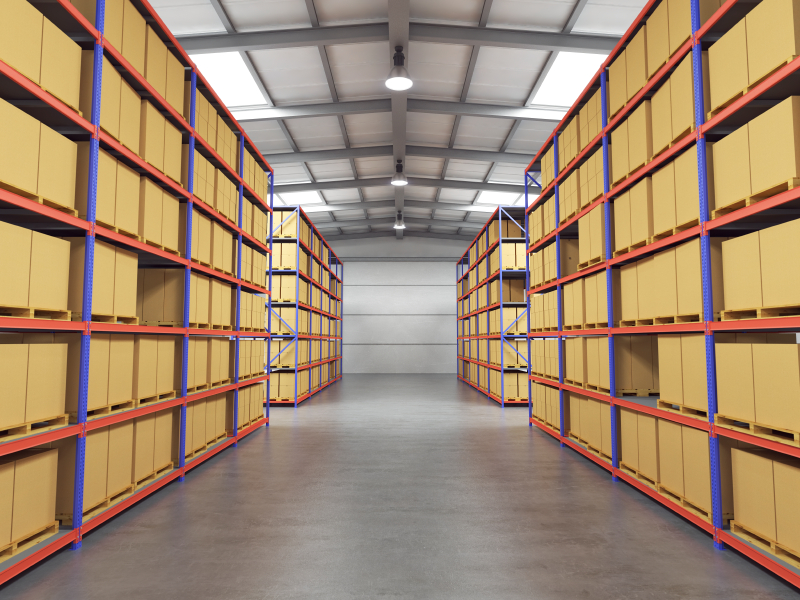
Find the location of a particular element. panels on wall is located at coordinates (394, 275), (390, 298), (396, 329), (394, 358).